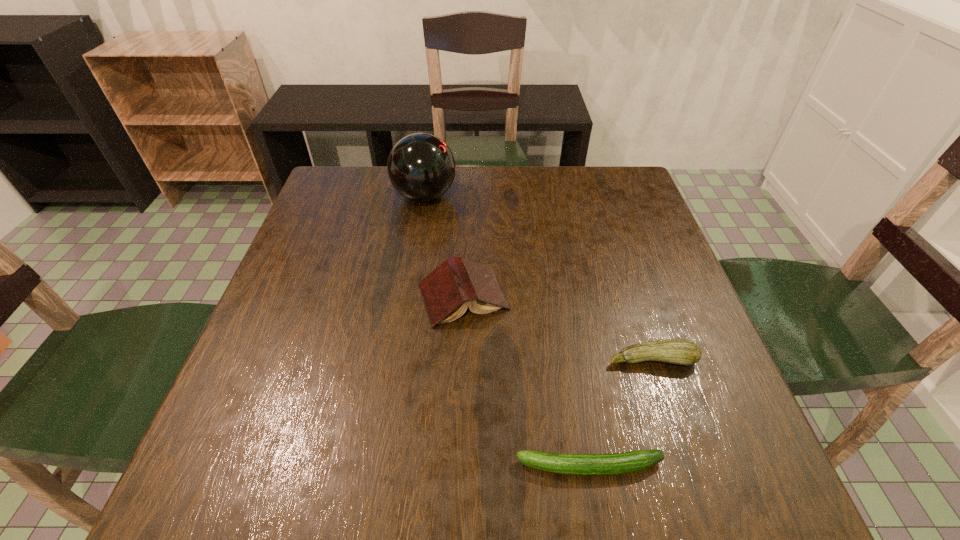
The image size is (960, 540). What are the coordinates of `vacant space at the right edge` in the screenshot? It's located at (627, 286).

I want to click on vacant space at the far left corner of the desktop, so click(x=349, y=184).

In the image, there is a desktop. Identify the location of vacant region at the far right corner. (617, 211).

This screenshot has width=960, height=540. In the image, there is a desktop. In order to click on vacant space at the near right corner in this screenshot , I will do `click(684, 487)`.

In order to click on vacant area that lies between the nearest object and the tallest object in this screenshot , I will do `click(507, 331)`.

This screenshot has height=540, width=960. Identify the location of vacant point located between the shorter zucchini and the tallest object. (507, 331).

This screenshot has width=960, height=540. Find the location of `free space between the book and the second shortest object`. free space between the book and the second shortest object is located at coordinates (558, 328).

Where is `free area in between the second nearest object and the shorter zucchini`? The height and width of the screenshot is (540, 960). free area in between the second nearest object and the shorter zucchini is located at coordinates (620, 413).

This screenshot has width=960, height=540. In order to click on vacant space that's between the bowling ball and the shortest object in this screenshot , I will do pos(507,331).

Identify the location of vacant region between the farthest object and the shortest object. (507, 331).